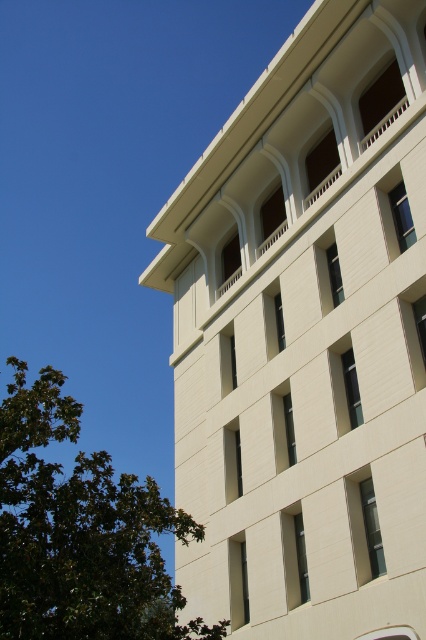
Question: Is white smooth building at upper center behind green leafy tree at lower left?

Choices:
 (A) yes
 (B) no

Answer: (A)

Question: Does white smooth building at upper center have a greater width compared to green leafy tree at lower left?

Choices:
 (A) no
 (B) yes

Answer: (A)

Question: Which point is closer to the camera?

Choices:
 (A) green leafy tree at lower left
 (B) white smooth building at upper center

Answer: (A)

Question: Among these points, which one is nearest to the camera?

Choices:
 (A) (40, 387)
 (B) (423, 275)

Answer: (A)

Question: Can you confirm if white smooth building at upper center is smaller than green leafy tree at lower left?

Choices:
 (A) yes
 (B) no

Answer: (A)